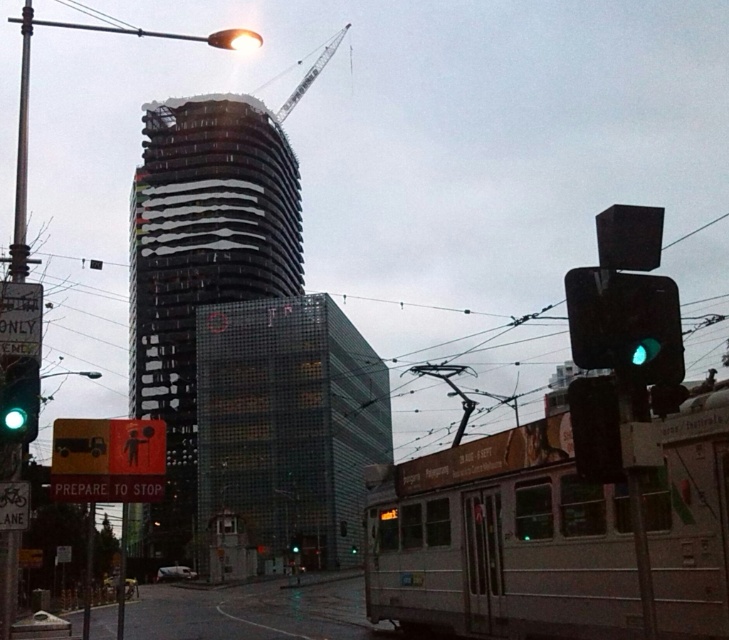
Looking at this image, can you confirm if silver metallic train at center is positioned to the left of green glass traffic light at center?

In fact, silver metallic train at center is to the right of green glass traffic light at center.

Is silver metallic train at center wider than green glass traffic light at center?

Indeed, silver metallic train at center has a greater width compared to green glass traffic light at center.

You are a GUI agent. You are given a task and a screenshot of the screen. Output one action in this format:
    pyautogui.click(x=<x>, y=<y>)
    Task: Click on the silver metallic train at center
    
    Given the screenshot: What is the action you would take?
    pyautogui.click(x=502, y=541)

Is point (28, 416) positioned after point (297, 545)?

No, it is not.

Is green glass traffic light at left below green glass traffic light at center?

No, green glass traffic light at left is not below green glass traffic light at center.

Is point (12, 416) positioned in front of point (297, 548)?

Yes, it is in front of point (297, 548).

Where is `green glass traffic light at left`? green glass traffic light at left is located at coordinates (19, 401).

Is silver metallic train at center taller than green glass traffic light at left?

Correct, silver metallic train at center is much taller as green glass traffic light at left.

Does silver metallic train at center come in front of green glass traffic light at left?

Yes, silver metallic train at center is in front of green glass traffic light at left.

Which is behind, point (720, 520) or point (0, 422)?

Point (0, 422)

I want to click on silver metallic train at center, so click(x=502, y=541).